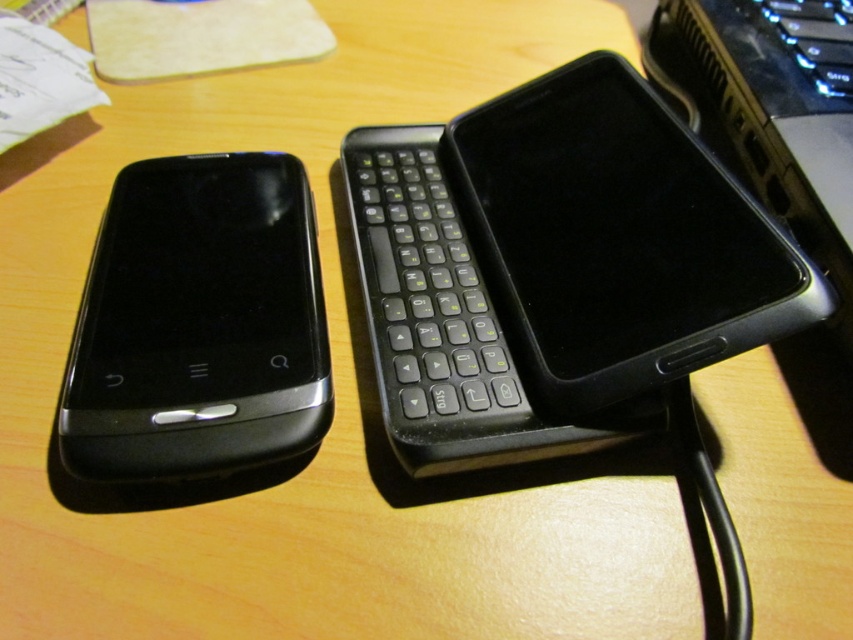
You have two smartphones on a table. One is the black matte smartphone at center and the other is the black glossy smartphone at left. Which one has a wider screen?

The black matte smartphone at center might be wider than the black glossy smartphone at left according to the description provided.

You are organizing a tech showcase and need to arrange these two smartphones. The black glossy smartphone at left must be placed to the left of the black matte smartphone at center. Is this arrangement already correct based on their current positions?

Yes, the arrangement is already correct because the black matte smartphone at center is currently positioned to the right of the black glossy smartphone at left, which matches the requirement.

Where is the black glossy smartphone at left located in the image?

The black glossy smartphone at left is located at point [198,323] in the image.